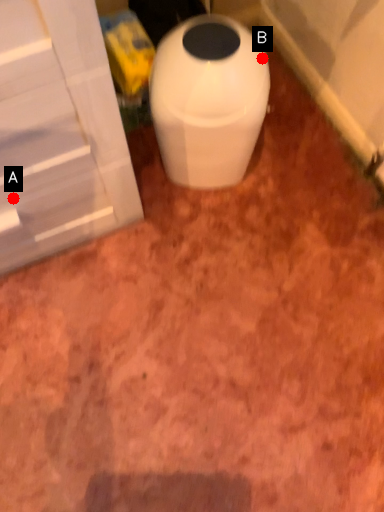
Question: Two points are circled on the image, labeled by A and B beside each circle. Which point is closer to the camera?

Choices:
 (A) A is closer
 (B) B is closer

Answer: (A)